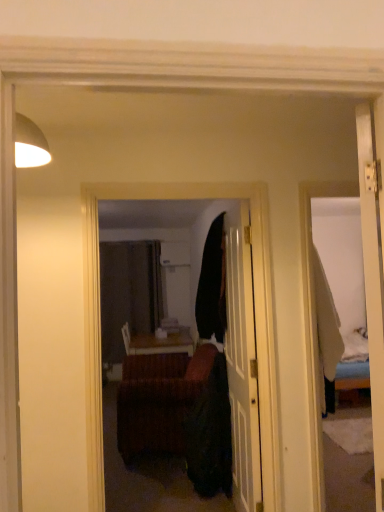
Where is `vacant space situated above matte black mirror at center (from a real-world perspective)`? This screenshot has width=384, height=512. vacant space situated above matte black mirror at center (from a real-world perspective) is located at coordinates (173, 182).